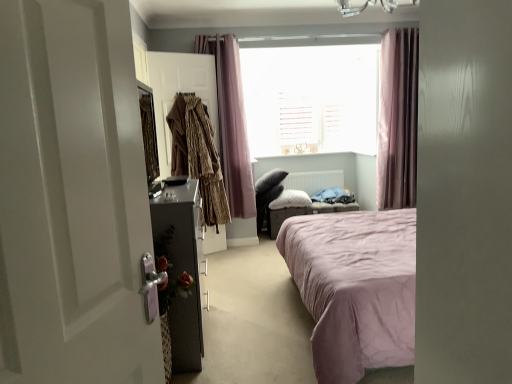
What are the coordinates of `white matte radiator at center` in the screenshot? It's located at (314, 181).

What is the approximate height of metallic dark gray nightstand at left?

metallic dark gray nightstand at left is 37.65 inches tall.

Identify the location of metallic dark gray nightstand at left. click(x=183, y=269).

The image size is (512, 384). What are the coordinates of `leopard print coat at left, marked as the 2th clothing in a left-to-right arrangement` in the screenshot? It's located at (198, 156).

Image resolution: width=512 pixels, height=384 pixels. I want to click on white matte radiator at center, so click(x=314, y=181).

Consider the image. Which is correct: pink fabric curtain at upper right, the first curtain when ordered from right to left, is inside metallic dark gray nightstand at left, or outside of it?

pink fabric curtain at upper right, the first curtain when ordered from right to left, lies outside metallic dark gray nightstand at left.

Considering the relative sizes of pink fabric curtain at upper right, positioned as the 2th curtain in left-to-right order, and metallic dark gray nightstand at left in the image provided, is pink fabric curtain at upper right, positioned as the 2th curtain in left-to-right order, thinner than metallic dark gray nightstand at left?

Indeed, pink fabric curtain at upper right, positioned as the 2th curtain in left-to-right order, has a lesser width compared to metallic dark gray nightstand at left.

Is the position of pink fabric curtain at upper right, positioned as the 2th curtain in left-to-right order, more distant than that of metallic dark gray nightstand at left?

Yes, pink fabric curtain at upper right, positioned as the 2th curtain in left-to-right order, is behind metallic dark gray nightstand at left.

How much distance is there between pink fabric curtain at upper right, the first curtain when ordered from right to left, and metallic dark gray nightstand at left?

pink fabric curtain at upper right, the first curtain when ordered from right to left, and metallic dark gray nightstand at left are 9.06 feet apart from each other.

Does pink fabric ottoman at center contain pink fabric curtain at upper right, the first curtain when ordered from right to left?

No, pink fabric curtain at upper right, the first curtain when ordered from right to left, is not surrounded by pink fabric ottoman at center.

Is pink fabric ottoman at center positioned with its back to pink fabric curtain at upper right, the first curtain when ordered from right to left?

No, pink fabric ottoman at center's orientation is not away from pink fabric curtain at upper right, the first curtain when ordered from right to left.

Considering the relative sizes of pink fabric ottoman at center and pink fabric curtain at upper right, positioned as the 2th curtain in left-to-right order, in the image provided, is pink fabric ottoman at center shorter than pink fabric curtain at upper right, positioned as the 2th curtain in left-to-right order,?

Yes.

I want to click on the 1st curtain in front of the pink fabric ottoman at center, counting from the anchor's position, so click(x=398, y=119).

Is point (377, 182) in front of point (357, 205)?

Yes, point (377, 182) is in front of point (357, 205).

Which is behind, pink fabric curtain at upper right, the first curtain when ordered from right to left, or pink fabric ottoman at center?

pink fabric ottoman at center.

Is pink fabric curtain at upper right, positioned as the 2th curtain in left-to-right order, facing towards pink fabric ottoman at center?

No, pink fabric curtain at upper right, positioned as the 2th curtain in left-to-right order, is not oriented towards pink fabric ottoman at center.

Where is `furniture below the pink fabric curtain at upper right, positioned as the 2th curtain in left-to-right order (from the image's perspective)`? Image resolution: width=512 pixels, height=384 pixels. furniture below the pink fabric curtain at upper right, positioned as the 2th curtain in left-to-right order (from the image's perspective) is located at coordinates (303, 213).

Considering the positions of point (271, 207) and point (245, 72), is point (271, 207) closer or farther from the camera than point (245, 72)?

Clearly, point (271, 207) is closer to the camera than point (245, 72).

From a real-world perspective, who is located lower, fluffy white pillow at center or white wooden blinds at center?

From a 3D spatial view, fluffy white pillow at center is below.

Is white wooden blinds at center at the back of fluffy white pillow at center?

fluffy white pillow at center does not have its back to white wooden blinds at center.

Does fluffy white pillow at center contain white wooden blinds at center?

No, white wooden blinds at center is not surrounded by fluffy white pillow at center.

Is white wooden blinds at center thinner than pink fabric curtain at upper center, the 2th curtain viewed from the right?

Yes, white wooden blinds at center is thinner than pink fabric curtain at upper center, the 2th curtain viewed from the right.

Where is `curtain that is the 1st object directly below the white wooden blinds at center (from a real-world perspective)`? This screenshot has height=384, width=512. curtain that is the 1st object directly below the white wooden blinds at center (from a real-world perspective) is located at coordinates pos(231,123).

From a real-world perspective, is white wooden blinds at center above or below pink fabric curtain at upper center, the 2th curtain viewed from the right?

Clearly, from a real-world perspective, white wooden blinds at center is above pink fabric curtain at upper center, the 2th curtain viewed from the right.

Is white wooden blinds at center facing towards pink fabric curtain at upper center, which is counted as the 1th curtain, starting from the left?

Yes, white wooden blinds at center is turned towards pink fabric curtain at upper center, which is counted as the 1th curtain, starting from the left.

Which is nearer, (176,105) or (188,135)?

Positioned in front is point (188,135).

Between brown textured coat at center, acting as the first clothing starting from the left, and leopard print coat at left, marked as the 2th clothing in a left-to-right arrangement, which one has smaller width?

Answer: brown textured coat at center, acting as the first clothing starting from the left.

The width and height of the screenshot is (512, 384). Identify the location of clothing located in front of the brown textured coat at center, the 2th clothing in the right-to-left sequence. (198, 156).

Is point (182, 119) positioned behind point (406, 155)?

That is False.

Considering the sizes of objects leopard print coat at left, marked as the 2th clothing in a left-to-right arrangement, and pink fabric curtain at upper right, positioned as the 2th curtain in left-to-right order, in the image provided, who is taller, leopard print coat at left, marked as the 2th clothing in a left-to-right arrangement, or pink fabric curtain at upper right, positioned as the 2th curtain in left-to-right order,?

pink fabric curtain at upper right, positioned as the 2th curtain in left-to-right order, is taller.

Are leopard print coat at left, marked as the 2th clothing in a left-to-right arrangement, and pink fabric curtain at upper right, the first curtain when ordered from right to left, making contact?

No.

This screenshot has height=384, width=512. I want to click on the 1st curtain positioned above the leopard print coat at left, marked as the 2th clothing in a left-to-right arrangement (from a real-world perspective), so click(398, 119).

Identify the location of curtain that is the 2nd one when counting backward from the metallic dark gray nightstand at left. The image size is (512, 384). (398, 119).

At what (x,y) coordinates should I click in order to perform the action: click on furniture lying on the left of pink fabric curtain at upper right, the first curtain when ordered from right to left. Please return your answer as a coordinate pair (x, y). The image size is (512, 384). Looking at the image, I should click on (303, 213).

Considering their positions, is white glossy door at left positioned closer to metallic dark gray nightstand at left than pink fabric curtain at upper center, which is counted as the 1th curtain, starting from the left?

Based on the image, white glossy door at left appears to be nearer to metallic dark gray nightstand at left.

Estimate the real-world distances between objects in this image. Which object is further from pink fabric ottoman at center, fluffy white pillow at center or pink fabric curtain at upper right, the first curtain when ordered from right to left?

pink fabric curtain at upper right, the first curtain when ordered from right to left, is positioned further to the anchor pink fabric ottoman at center.

Estimate the real-world distances between objects in this image. Which object is further from white glossy door at left, pink fabric ottoman at center or leopard print coat at left, positioned as the first clothing in right-to-left order?

The object further to white glossy door at left is pink fabric ottoman at center.

Looking at the image, which one is located closer to pink fabric ottoman at center, metallic dark gray nightstand at left or white wooden blinds at center?

white wooden blinds at center is closer to pink fabric ottoman at center.

Estimate the real-world distances between objects in this image. Which object is closer to white glossy door at left, white matte radiator at center or brown textured coat at center, the 2th clothing in the right-to-left sequence?

Based on the image, brown textured coat at center, the 2th clothing in the right-to-left sequence, appears to be nearer to white glossy door at left.

In the scene shown: From the image, which object appears to be farther from pink fabric curtain at upper center, the 2th curtain viewed from the right, pink fabric curtain at upper right, the first curtain when ordered from right to left, or leopard print coat at left, marked as the 2th clothing in a left-to-right arrangement?

pink fabric curtain at upper right, the first curtain when ordered from right to left, lies further to pink fabric curtain at upper center, the 2th curtain viewed from the right, than the other object.

From the image, which object appears to be farther from pink fabric ottoman at center, white glossy door at left or brown textured coat at center, the 2th clothing in the right-to-left sequence?

white glossy door at left is further to pink fabric ottoman at center.

In the scene shown: Which object lies nearer to the anchor point leopard print coat at left, positioned as the first clothing in right-to-left order, fluffy white pillow at center or pink fabric curtain at upper right, the first curtain when ordered from right to left?

Based on the image, fluffy white pillow at center appears to be nearer to leopard print coat at left, positioned as the first clothing in right-to-left order.

The image size is (512, 384). In order to click on clothing between metallic dark gray nightstand at left and pink fabric curtain at upper right, the first curtain when ordered from right to left, in the horizontal direction in this screenshot , I will do `click(198, 156)`.

The image size is (512, 384). Find the location of `furniture between metallic dark gray nightstand at left and white wooden blinds at center from front to back`. furniture between metallic dark gray nightstand at left and white wooden blinds at center from front to back is located at coordinates (303, 213).

I want to click on pillow situated between brown textured coat at center, acting as the first clothing starting from the left, and pink fabric ottoman at center from left to right, so click(291, 200).

You are a GUI agent. You are given a task and a screenshot of the screen. Output one action in this format:
    pyautogui.click(x=<x>, y=<y>)
    Task: Click on the pillow located between leopard print coat at left, marked as the 2th clothing in a left-to-right arrangement, and white matte radiator at center in the depth direction
    
    Given the screenshot: What is the action you would take?
    point(291,200)